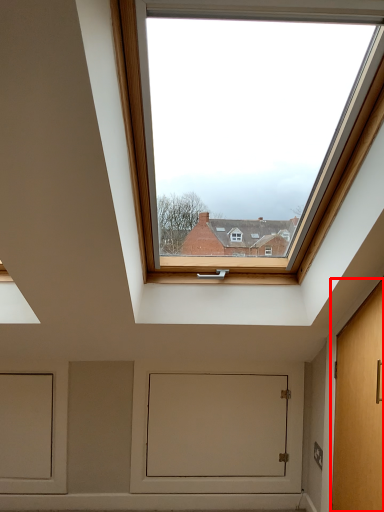
Question: From the image's perspective, considering the relative positions of door (annotated by the red box) and window screen in the image provided, where is door (annotated by the red box) located with respect to the staircase?

Choices:
 (A) above
 (B) below

Answer: (A)